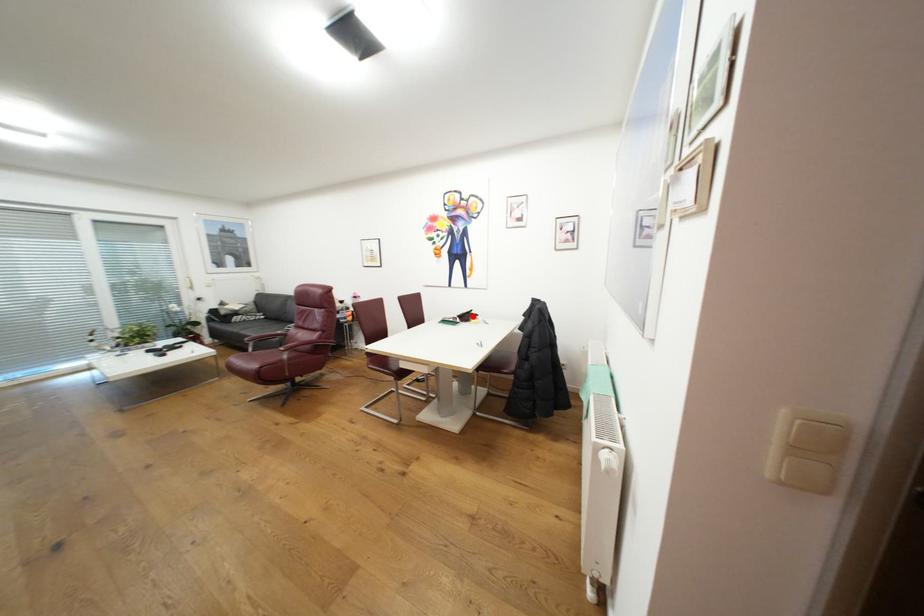
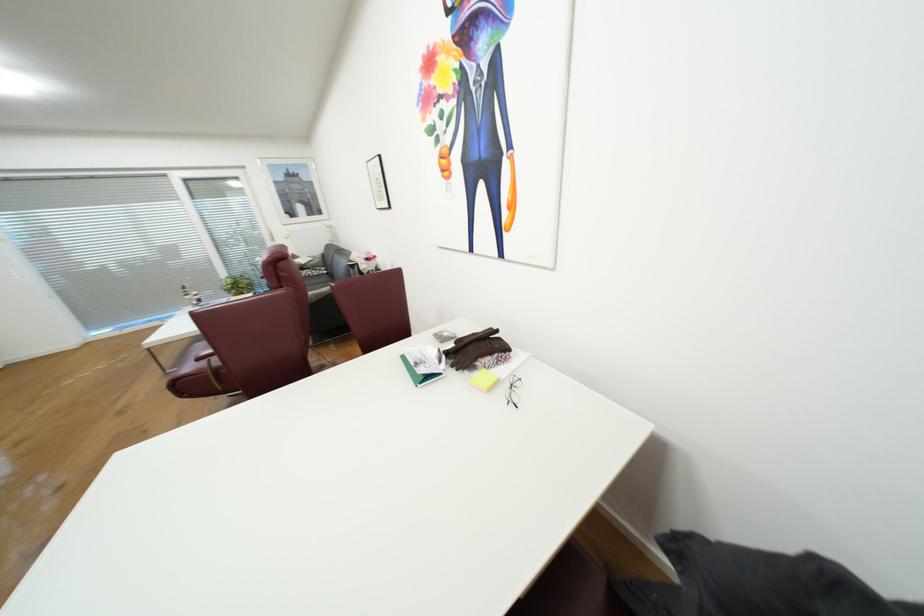
Where in the second image is the point corresponding to the highlighted location from the first image?

(481, 350)